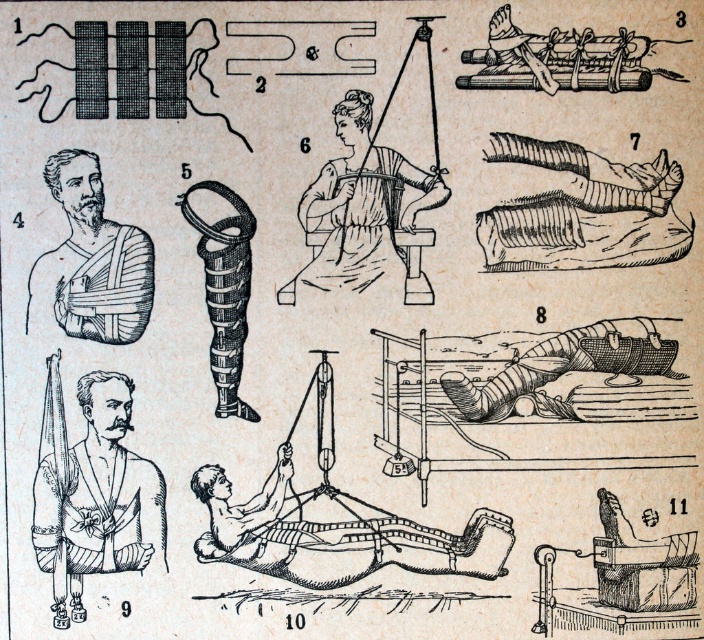
Question: Based on their relative distances, which object is farther from the matte brown bandages at center?

Choices:
 (A) wooden board at center
 (B) smooth white dress at center
 (C) matte wooden leg at center

Answer: (C)

Question: Is wooden board at center wider than brown leather arm at upper left?

Choices:
 (A) yes
 (B) no

Answer: (A)

Question: Does wooden board at center appear on the right side of brown leather arm at upper left?

Choices:
 (A) yes
 (B) no

Answer: (A)

Question: Among these objects, which one is nearest to the camera?

Choices:
 (A) smooth white dress at center
 (B) matte wooden leg at center

Answer: (A)

Question: Based on their relative distances, which object is farther from the smooth white dress at center?

Choices:
 (A) brown leather arm at upper left
 (B) matte brown bandages at center

Answer: (B)

Question: Is matte brown bandages at center above matte wooden leg at center?

Choices:
 (A) no
 (B) yes

Answer: (A)